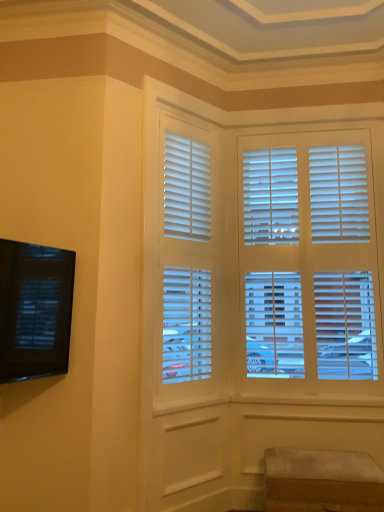
Question: Considering the positions of point (200, 252) and point (365, 478), is point (200, 252) closer or farther from the camera than point (365, 478)?

Choices:
 (A) closer
 (B) farther

Answer: (B)

Question: Is white matte blinds at center wider or thinner than suede ottoman at lower right?

Choices:
 (A) thin
 (B) wide

Answer: (A)

Question: Which object is the farthest from the suede ottoman at lower right?

Choices:
 (A) black glossy tv at left
 (B) white matte blinds at center

Answer: (A)

Question: Which object is positioned closest to the white matte blinds at center?

Choices:
 (A) suede ottoman at lower right
 (B) black glossy tv at left

Answer: (B)